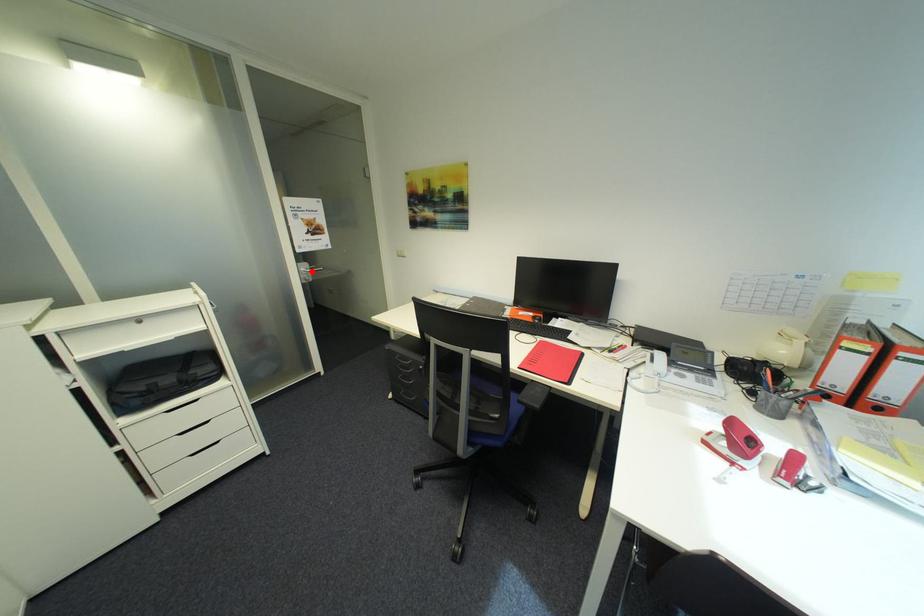
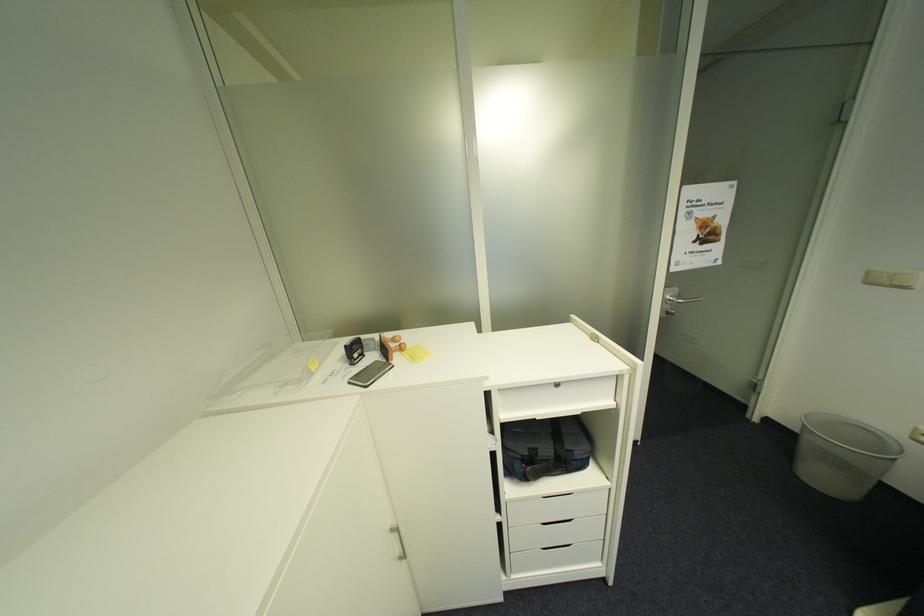
The point at the highlighted location is marked in the first image. Where is the corresponding point in the second image?

(676, 301)